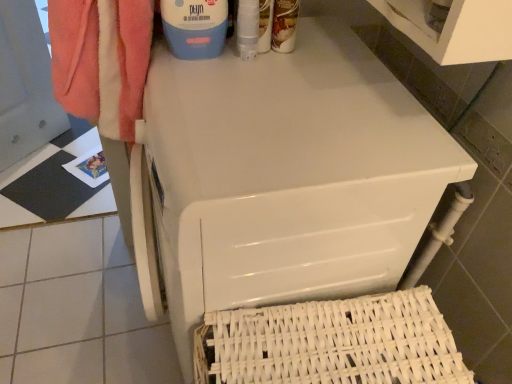
Locate an element on the screen. free space in front of blue plastic container at upper center, acting as the 2th cleaning product starting from the right is located at coordinates (203, 82).